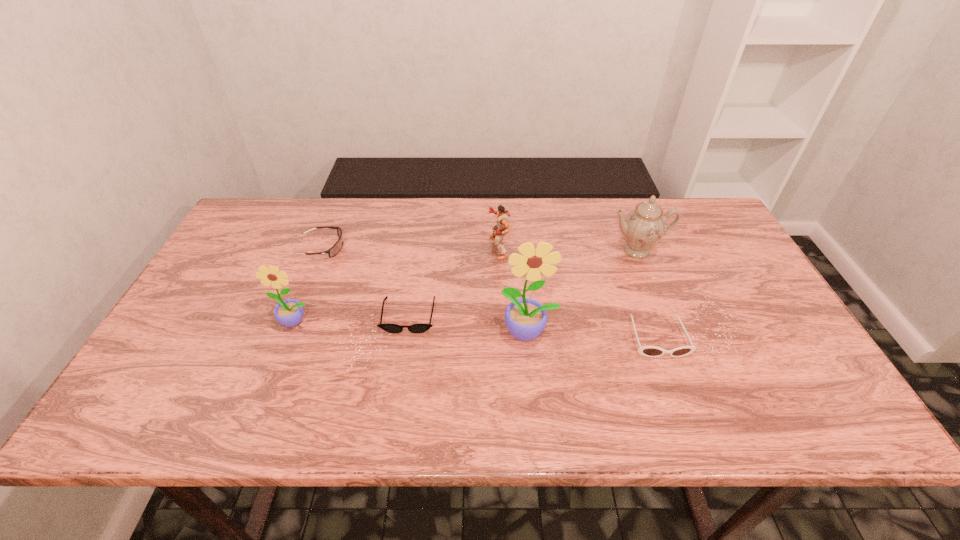
Please point a free position for a sunflower on the right. Please provide its 2D coordinates. Your answer should be formatted as a tuple, i.e. [(x, y)], where the tuple contains the x and y coordinates of a point satisfying the conditions above.

[(772, 344)]